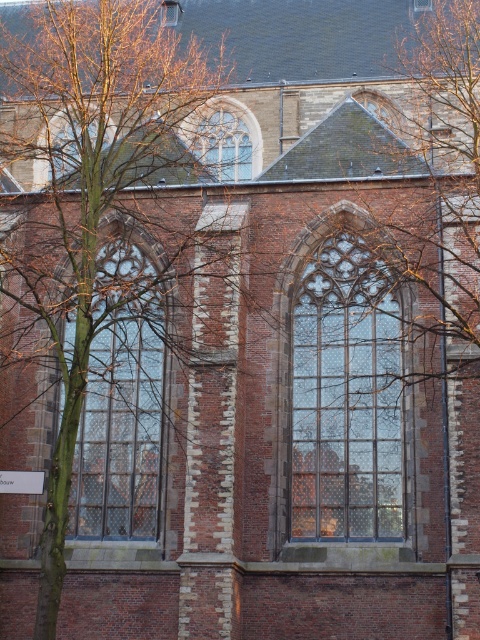
Question: Which object is positioned farthest from the clear glass window at left?

Choices:
 (A) clear glass window at center
 (B) clear glass window at upper center

Answer: (B)

Question: Does clear glass window at center lie in front of clear glass window at upper center?

Choices:
 (A) yes
 (B) no

Answer: (A)

Question: Which point is farther to the camera?

Choices:
 (A) (71, 333)
 (B) (214, 154)

Answer: (B)

Question: Among these points, which one is farthest from the camera?

Choices:
 (A) (97, 282)
 (B) (239, 141)
 (C) (294, 385)

Answer: (B)

Question: Does clear glass window at left come in front of clear glass window at upper center?

Choices:
 (A) yes
 (B) no

Answer: (A)

Question: Can you confirm if clear glass window at left is positioned below clear glass window at upper center?

Choices:
 (A) yes
 (B) no

Answer: (A)